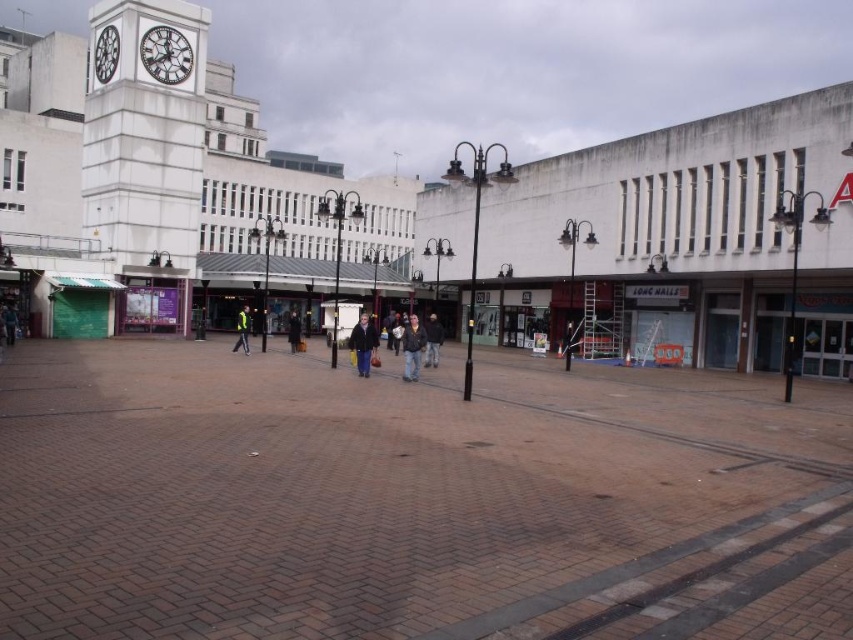
You are a fashion designer observing two coats in the plaza. The dark gray jacket at center and the dark brown leather coat at center are both placed on a rack. Which one is shorter in height?

The dark gray jacket at center is shorter in height compared to the dark brown leather coat at center.

You are a delivery person who needs to place a package between the dark gray jacket at center and the dark brown leather coat at center. The package requires 10 meters of space. Can you fit it between them?

The dark gray jacket at center and the dark brown leather coat at center are 11.13 meters apart from each other, which is more than enough space to accommodate a package requiring 10 meters of space.

You are a delivery person standing at the edge of the plaza. You need to hand a package to the person wearing the dark blue jacket at center and the dark brown leather coat at center. Which person should you approach first to ensure you can see both individuals clearly?

You should approach the dark blue jacket at center first because it is in front of the dark brown leather coat at center, making both visible.